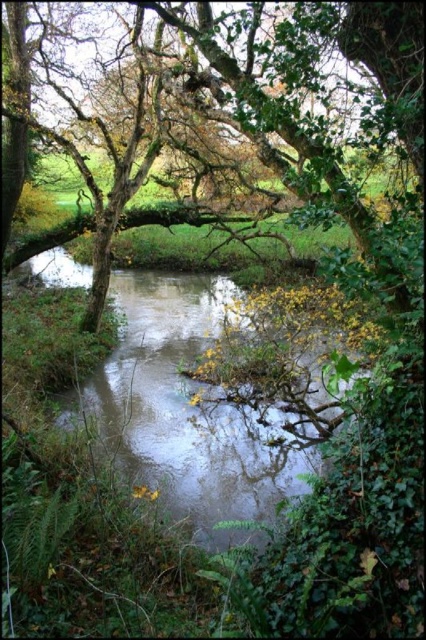
Question: Is clear water at center below green leafy tree at center?

Choices:
 (A) yes
 (B) no

Answer: (A)

Question: Is clear water at center behind green leafy tree at center?

Choices:
 (A) no
 (B) yes

Answer: (A)

Question: Is clear water at center further to camera compared to green leafy tree at center?

Choices:
 (A) no
 (B) yes

Answer: (A)

Question: Which point appears farthest from the camera in this image?

Choices:
 (A) (180, 308)
 (B) (373, 234)

Answer: (A)